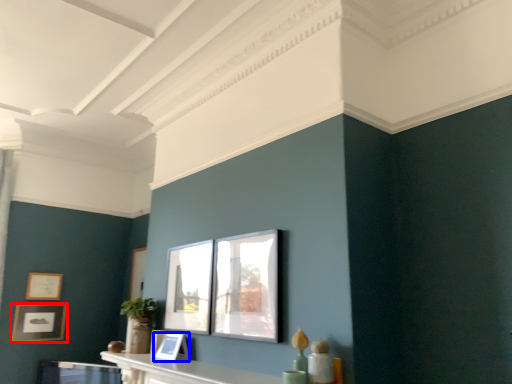
Question: Which point is closer to the camera, picture frame (highlighted by a red box) or picture frame (highlighted by a blue box)?

Choices:
 (A) picture frame
 (B) picture frame

Answer: (B)